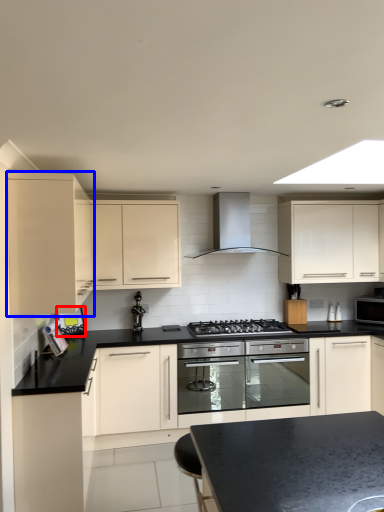
Question: Which point is further to the camera, appliance (highlighted by a red box) or cabinetry (highlighted by a blue box)?

Choices:
 (A) appliance
 (B) cabinetry

Answer: (A)